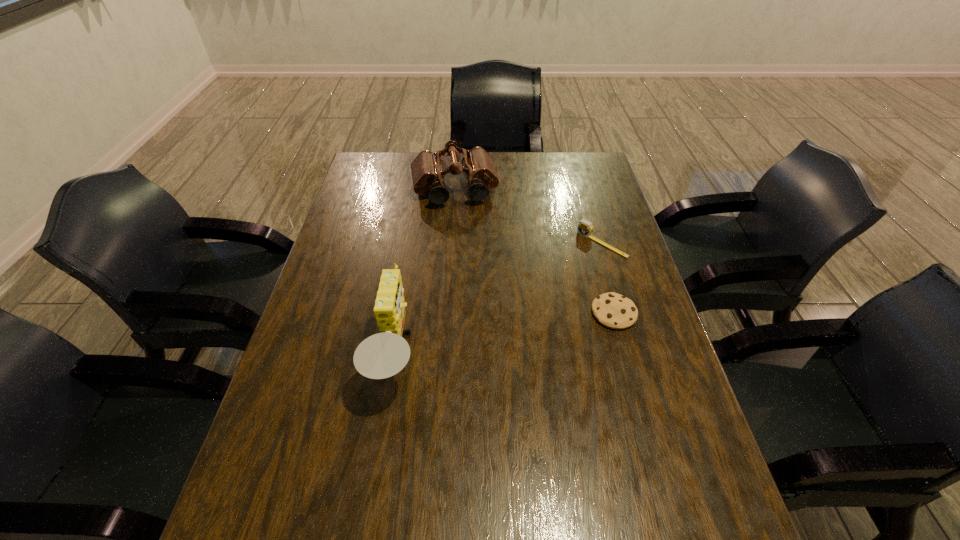
The image size is (960, 540). I want to click on vacant region located 0.320m through the eyepieces of the farthest object, so click(x=471, y=278).

The image size is (960, 540). I want to click on free space located at the front of the second farthest object with the tape extended, so click(579, 262).

Find the location of a particular element. The width and height of the screenshot is (960, 540). free space located 0.290m at the front of the second farthest object with the tape extended is located at coordinates (527, 306).

The image size is (960, 540). In order to click on free location located 0.190m at the front of the second farthest object with the tape extended in this screenshot , I will do `click(550, 287)`.

Identify the location of object that is at the far edge. The width and height of the screenshot is (960, 540). (427, 170).

The height and width of the screenshot is (540, 960). In order to click on cookie that is at the right edge in this screenshot , I will do `click(615, 311)`.

At what (x,y) coordinates should I click in order to perform the action: click on tape measure that is positioned at the right edge. Please return your answer as a coordinate pair (x, y). Looking at the image, I should click on (585, 227).

Where is `vacant space at the far edge of the desktop`? Image resolution: width=960 pixels, height=540 pixels. vacant space at the far edge of the desktop is located at coordinates (555, 180).

Where is `vacant region at the left edge of the desktop`? This screenshot has width=960, height=540. vacant region at the left edge of the desktop is located at coordinates (372, 288).

The width and height of the screenshot is (960, 540). In order to click on free region at the right edge of the desktop in this screenshot , I will do `click(597, 225)`.